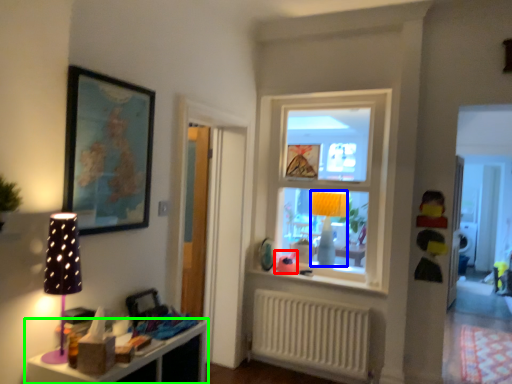
Question: Based on their relative distances, which object is farther from toy (highlighted by a red box)? Choose from table lamp (highlighted by a blue box) and shelf (highlighted by a green box).

Choices:
 (A) table lamp
 (B) shelf

Answer: (B)